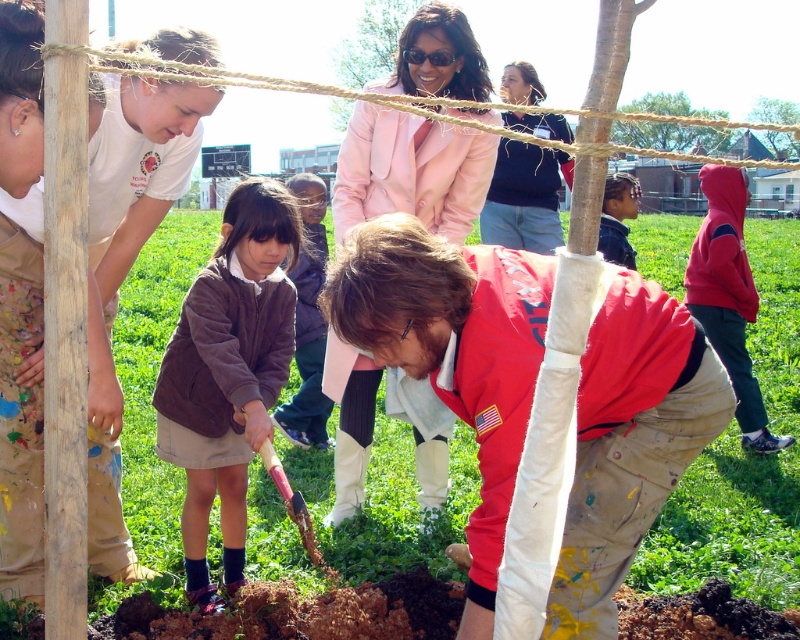
Question: Can you confirm if brown suede jacket at center is thinner than dark brown hoodie at center?

Choices:
 (A) yes
 (B) no

Answer: (B)

Question: Does brown fuzzy sweater at center appear under brown suede jacket at left?

Choices:
 (A) no
 (B) yes

Answer: (A)

Question: Which is farther from the dark brown hoodie at center?

Choices:
 (A) brown fuzzy sweater at center
 (B) brown suede jacket at center

Answer: (A)

Question: Which point is farther to the camera?

Choices:
 (A) (654, 406)
 (B) (625, 179)

Answer: (B)

Question: Which of the following is the closest to the observer?

Choices:
 (A) smooth wooden post at upper right
 (B) brown fuzzy sweater at center
 (C) dark blue sweater at center

Answer: (B)

Question: Is matte pink blazer at center positioned at the back of green leafy tree at upper center?

Choices:
 (A) no
 (B) yes

Answer: (B)